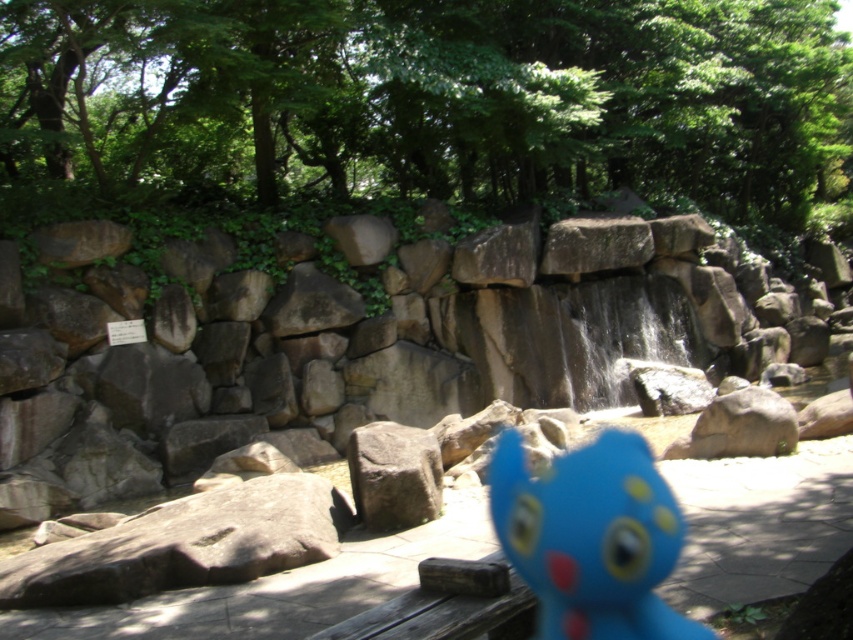
Is green leafy tree at upper center to the right of blue rubber toy at center from the viewer's perspective?

Correct, you'll find green leafy tree at upper center to the right of blue rubber toy at center.

Is green leafy tree at upper center closer to camera compared to blue rubber toy at center?

No, it is behind blue rubber toy at center.

Between point (811, 100) and point (577, 595), which one is positioned in front?

Positioned in front is point (577, 595).

Image resolution: width=853 pixels, height=640 pixels. I want to click on green leafy tree at upper center, so click(436, 97).